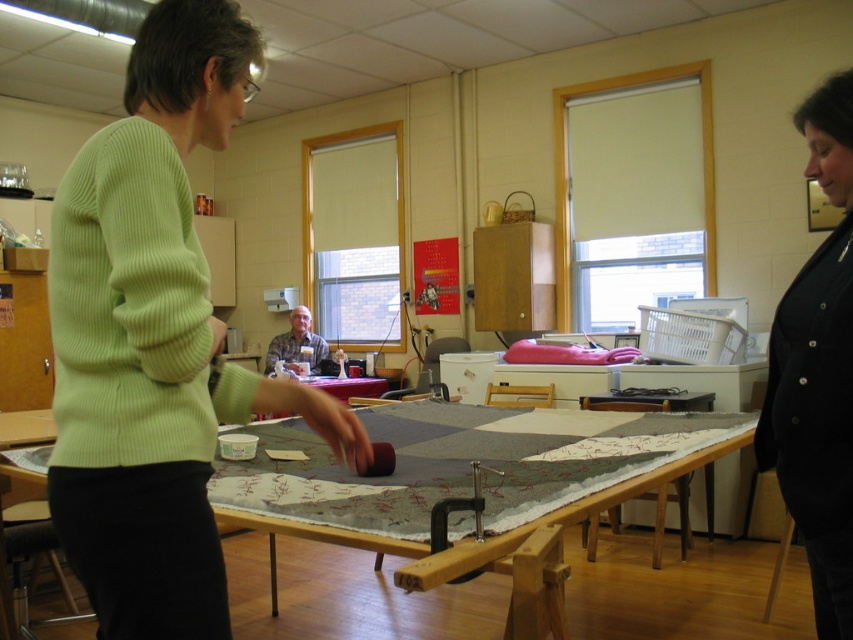
Between green ribbed sweater at left and textured wool quilt at center, which one has less height?

Standing shorter between the two is textured wool quilt at center.

Is green ribbed sweater at left smaller than textured wool quilt at center?

Actually, green ribbed sweater at left might be larger than textured wool quilt at center.

Image resolution: width=853 pixels, height=640 pixels. What do you see at coordinates (154, 339) in the screenshot?
I see `green ribbed sweater at left` at bounding box center [154, 339].

This screenshot has width=853, height=640. What are the coordinates of `green ribbed sweater at left` in the screenshot? It's located at (154, 339).

Is textured wool quilt at center positioned at the back of gray fabric at center?

No, textured wool quilt at center is closer to the viewer.

Between point (300, 518) and point (265, 369), which one is positioned in front?

Point (300, 518) is in front.

The image size is (853, 640). I want to click on textured wool quilt at center, so click(447, 468).

Which of these two, wooden table at center or gray fabric at center, stands taller?

Standing taller between the two is gray fabric at center.

Where is `wooden table at center`? The width and height of the screenshot is (853, 640). wooden table at center is located at coordinates (453, 468).